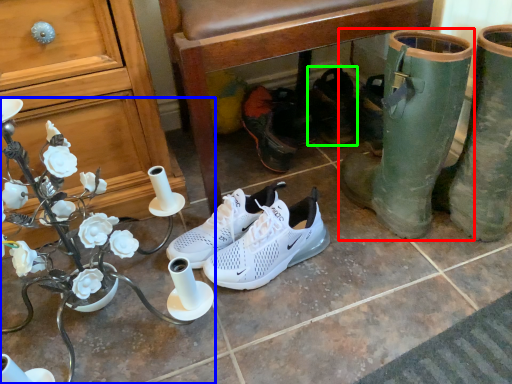
Question: Estimate the real-world distances between objects in this image. Which object is closer to footwear (highlighted by a red box), desk (highlighted by a blue box) or footwear (highlighted by a green box)?

Choices:
 (A) desk
 (B) footwear

Answer: (B)